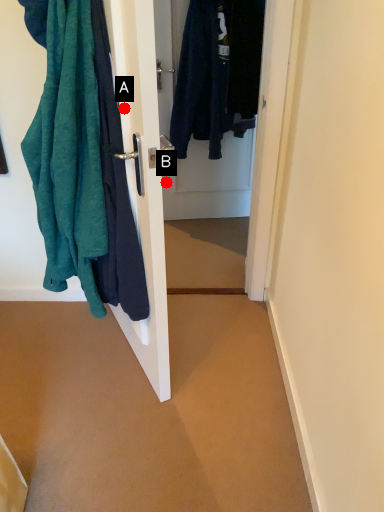
Question: Two points are circled on the image, labeled by A and B beside each circle. Which point is closer to the camera?

Choices:
 (A) A is closer
 (B) B is closer

Answer: (A)